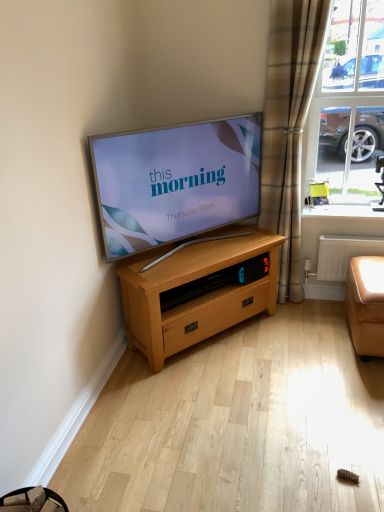
Find the location of a particular element. The height and width of the screenshot is (512, 384). unoccupied region to the right of light oak wooden chest of drawers at center is located at coordinates point(301,340).